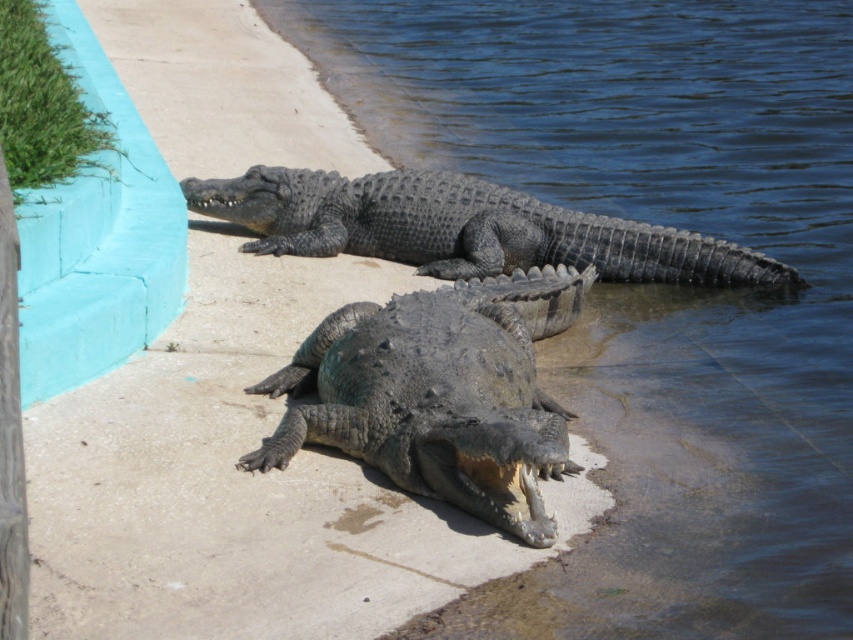
You are standing at the origin point of the coordinate system. You want to reach the clear blue water at center. What are the coordinates you need to move to?

The coordinates to reach the clear blue water at center are at point (654,285).

Based on the photo, you are a wildlife photographer standing at the edge of a swamp. You see a shiny dark green crocodile at center. Can you safely take a photo of the crocodile from your current position without getting too close? Explain your reasoning.

The shiny dark green crocodile at center is 5.14 meters from camera. Since 5.14 meters is a safe distance for photographing wildlife, you can safely take the photo without getting too close.

You are a zookeeper observing the two crocodiles in the enclosure. You notice that the shiny dark green crocodile at center and the shiny dark gray crocodile at upper center are positioned in a way that one is blocking your view of the other. Which crocodile is blocking the other?

The shiny dark green crocodile at center is blocking the view of the shiny dark gray crocodile at upper center because it is positioned in front of it.